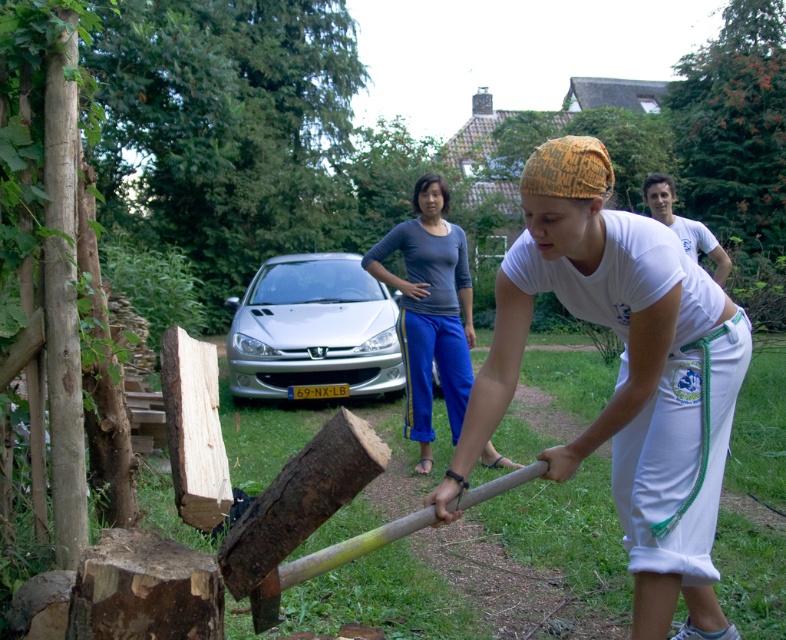
Does silver metallic car at center appear over dark gray cotton shirt at center?

Yes, silver metallic car at center is above dark gray cotton shirt at center.

Identify the location of silver metallic car at center. (313, 330).

Between point (355, 257) and point (403, 220), which one is positioned in front?

Point (355, 257) is more forward.

Image resolution: width=786 pixels, height=640 pixels. What are the coordinates of `silver metallic car at center` in the screenshot? It's located at (313, 330).